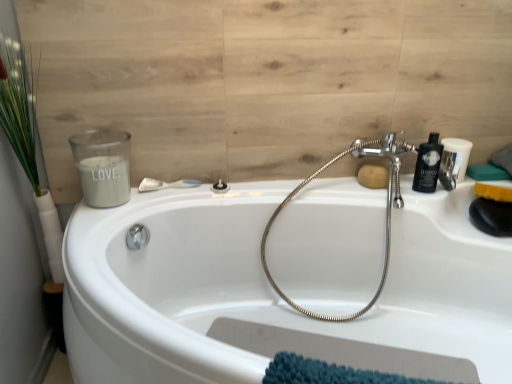
Question: From a real-world perspective, is wooden panel at upper left on white plastic shower at upper center, which is counted as the 1th shower, starting from the left?

Choices:
 (A) no
 (B) yes

Answer: (B)

Question: Would you say wooden panel at upper left contains white plastic shower at upper center, which is counted as the 1th shower, starting from the left?

Choices:
 (A) no
 (B) yes

Answer: (A)

Question: Does wooden panel at upper left come behind white plastic shower at upper center, which is the second shower in right-to-left order?

Choices:
 (A) no
 (B) yes

Answer: (A)

Question: Does wooden panel at upper left have a greater width compared to white plastic shower at upper center, which is the second shower in right-to-left order?

Choices:
 (A) no
 (B) yes

Answer: (A)

Question: Is wooden panel at upper left placed right next to white plastic shower at upper center, which is the second shower in right-to-left order?

Choices:
 (A) no
 (B) yes

Answer: (A)

Question: Does wooden panel at upper left have a lesser height compared to white plastic shower at upper center, which is counted as the 1th shower, starting from the left?

Choices:
 (A) yes
 (B) no

Answer: (B)

Question: Is white matte candle at upper left located outside green leafy plant at left?

Choices:
 (A) no
 (B) yes

Answer: (B)

Question: Can you confirm if white matte candle at upper left is shorter than green leafy plant at left?

Choices:
 (A) yes
 (B) no

Answer: (A)

Question: Is white matte candle at upper left bigger than green leafy plant at left?

Choices:
 (A) yes
 (B) no

Answer: (B)

Question: Is white matte candle at upper left behind green leafy plant at left?

Choices:
 (A) no
 (B) yes

Answer: (B)

Question: Is white matte candle at upper left far away from green leafy plant at left?

Choices:
 (A) yes
 (B) no

Answer: (B)

Question: Is white matte candle at upper left wider than green leafy plant at left?

Choices:
 (A) yes
 (B) no

Answer: (B)

Question: Does chrome flexible hose at upper right have a smaller size compared to wooden panel at upper left?

Choices:
 (A) yes
 (B) no

Answer: (B)